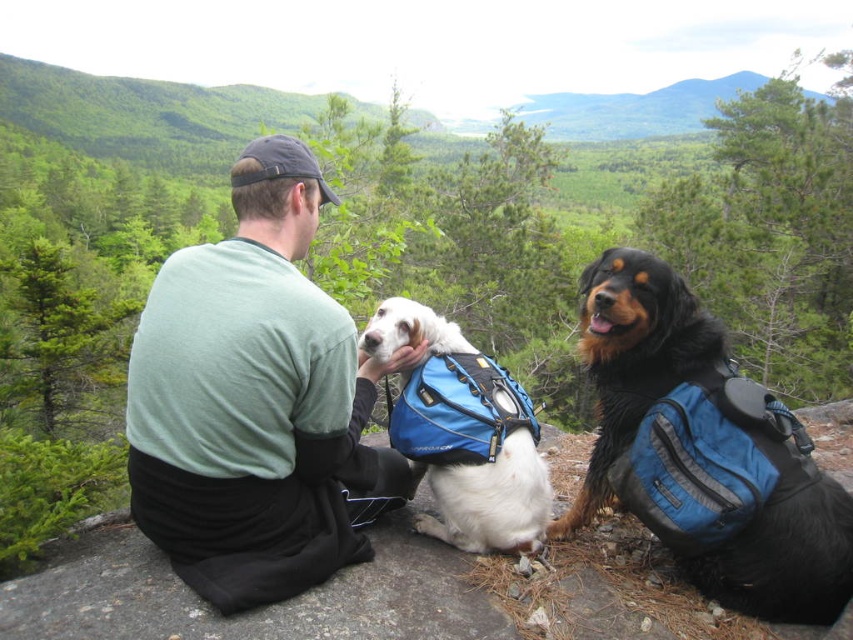
Question: Is black fuzzy dog at center further to the viewer compared to white soft fur dog at center?

Choices:
 (A) no
 (B) yes

Answer: (A)

Question: Is green cotton shirt at center bigger than white soft fur dog at center?

Choices:
 (A) yes
 (B) no

Answer: (A)

Question: Which point is farther from the camera taking this photo?

Choices:
 (A) (479, 481)
 (B) (294, 508)
 (C) (608, 416)

Answer: (C)

Question: Which of the following is the farthest from the observer?

Choices:
 (A) white soft fur dog at center
 (B) green cotton shirt at center

Answer: (A)

Question: Does green cotton shirt at center appear under white soft fur dog at center?

Choices:
 (A) yes
 (B) no

Answer: (B)

Question: Which of the following is the closest to the observer?

Choices:
 (A) (715, 376)
 (B) (316, 224)

Answer: (B)